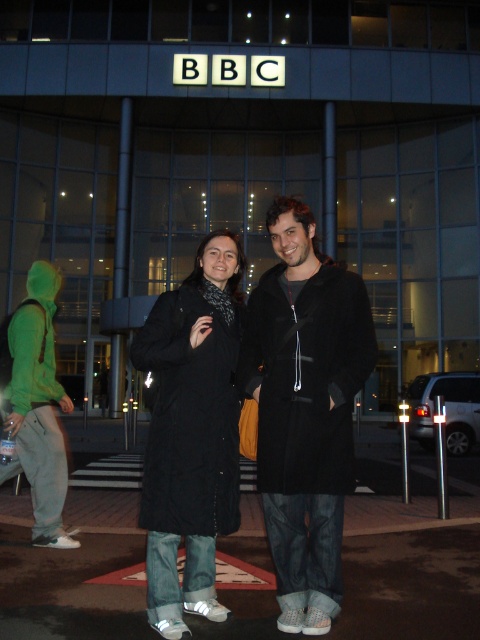
The height and width of the screenshot is (640, 480). Describe the element at coordinates (304, 410) in the screenshot. I see `black wool coat at center` at that location.

Does point (298, 516) come closer to viewer compared to point (230, 289)?

Yes, point (298, 516) is closer to viewer.

At what (x,y) coordinates should I click in order to perform the action: click on black wool coat at center. Please return your answer as a coordinate pair (x, y). The height and width of the screenshot is (640, 480). Looking at the image, I should click on (304, 410).

This screenshot has width=480, height=640. I want to click on black wool coat at center, so click(304, 410).

Who is positioned more to the left, black wool coat at center or green hoodie at left?

Positioned to the left is green hoodie at left.

Identify the location of black wool coat at center. (304, 410).

Can you confirm if black matte coat at center is positioned to the right of green hoodie at left?

Yes, black matte coat at center is to the right of green hoodie at left.

Does black matte coat at center appear over green hoodie at left?

Yes.

Which is in front, point (169, 310) or point (29, 401)?

Point (169, 310)

At what (x,y) coordinates should I click in order to perform the action: click on black matte coat at center. Please return your answer as a coordinate pair (x, y). Looking at the image, I should click on (192, 433).